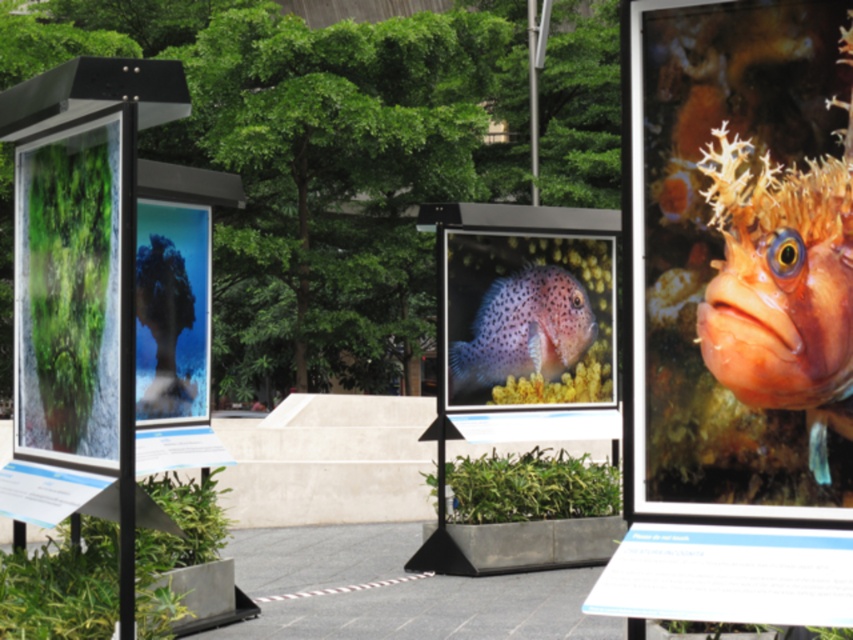
Question: Among these points, which one is nearest to the camera?

Choices:
 (A) (122, 148)
 (B) (482, 376)
 (C) (518, 392)

Answer: (A)

Question: Which object is farther from the camera taking this photo?

Choices:
 (A) transparent glass coral at center
 (B) transparent glass panels at left
 (C) matte plastic fish at center

Answer: (C)

Question: Does orange textured fish at right have a larger size compared to transparent glass coral at center?

Choices:
 (A) no
 (B) yes

Answer: (A)

Question: Which point is closer to the camera?

Choices:
 (A) matte plastic fish at center
 (B) green matte poster at left
 (C) spotted orange fish at center
 (D) transparent glass panels at left

Answer: (D)

Question: Does green matte poster at left have a greater width compared to transparent glass panels at left?

Choices:
 (A) yes
 (B) no

Answer: (B)

Question: Does transparent glass panels at left have a lesser width compared to spotted orange fish at center?

Choices:
 (A) yes
 (B) no

Answer: (A)